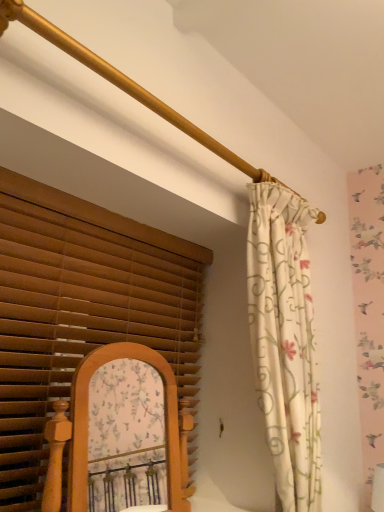
Measure the distance between floral fabric curtain at right and camera.

The depth of floral fabric curtain at right is 4.42 feet.

This screenshot has height=512, width=384. Identify the location of floral fabric curtain at right. (284, 340).

Image resolution: width=384 pixels, height=512 pixels. What do you see at coordinates (284, 340) in the screenshot? I see `floral fabric curtain at right` at bounding box center [284, 340].

Where is `brown wood blinds at left`? This screenshot has width=384, height=512. brown wood blinds at left is located at coordinates (81, 311).

The height and width of the screenshot is (512, 384). Describe the element at coordinates (81, 311) in the screenshot. I see `brown wood blinds at left` at that location.

The height and width of the screenshot is (512, 384). In order to click on floral fabric curtain at right in this screenshot , I will do `click(284, 340)`.

Does floral fabric curtain at right appear on the right side of brown wood blinds at left?

Yes, floral fabric curtain at right is to the right of brown wood blinds at left.

In the image, is floral fabric curtain at right positioned in front of or behind brown wood blinds at left?

In the image, floral fabric curtain at right appears behind brown wood blinds at left.

Considering the positions of point (309, 403) and point (43, 397), is point (309, 403) closer or farther from the camera than point (43, 397)?

Point (309, 403) is positioned farther from the camera compared to point (43, 397).

From the image's perspective, which one is positioned lower, floral fabric curtain at right or brown wood blinds at left?

brown wood blinds at left appears lower in the image.

From a real-world perspective, relative to brown wood blinds at left, is floral fabric curtain at right vertically above or below?

From a real-world perspective, floral fabric curtain at right is physically above brown wood blinds at left.

Considering the sizes of floral fabric curtain at right and brown wood blinds at left in the image, is floral fabric curtain at right wider or thinner than brown wood blinds at left?

floral fabric curtain at right is wider than brown wood blinds at left.

Consider the image. Which of these two, floral fabric curtain at right or brown wood blinds at left, stands taller?

With more height is floral fabric curtain at right.

Is floral fabric curtain at right smaller than brown wood blinds at left?

No, floral fabric curtain at right is not smaller than brown wood blinds at left.

Do you think floral fabric curtain at right is within brown wood blinds at left, or outside of it?

floral fabric curtain at right is outside brown wood blinds at left.

Is floral fabric curtain at right touching brown wood blinds at left?

No, floral fabric curtain at right is not making contact with brown wood blinds at left.

Could you tell me if floral fabric curtain at right is turned towards brown wood blinds at left?

No, floral fabric curtain at right is not turned towards brown wood blinds at left.

Consider the image. Measure the distance from floral fabric curtain at right to brown wood blinds at left.

They are 20.38 inches apart.

Identify the location of curtain that is behind the brown wood blinds at left. The image size is (384, 512). (284, 340).

Does brown wood blinds at left appear on the right side of floral fabric curtain at right?

No.

Which object is further away from the camera taking this photo, brown wood blinds at left or floral fabric curtain at right?

floral fabric curtain at right.

Does point (80, 322) lie behind point (272, 281)?

No, (80, 322) is in front of (272, 281).

From the image's perspective, relative to floral fabric curtain at right, is brown wood blinds at left above or below?

From the image's perspective, brown wood blinds at left appears below floral fabric curtain at right.

From a real-world perspective, which object stands above the other?

In real-world perspective, floral fabric curtain at right is above.

In the scene shown: Considering the sizes of objects brown wood blinds at left and floral fabric curtain at right in the image provided, who is wider, brown wood blinds at left or floral fabric curtain at right?

Wider between the two is floral fabric curtain at right.

Considering the sizes of objects brown wood blinds at left and floral fabric curtain at right in the image provided, who is shorter, brown wood blinds at left or floral fabric curtain at right?

With less height is brown wood blinds at left.

Considering the relative sizes of brown wood blinds at left and floral fabric curtain at right in the image provided, is brown wood blinds at left smaller than floral fabric curtain at right?

Yes, brown wood blinds at left is smaller than floral fabric curtain at right.

Is brown wood blinds at left outside of floral fabric curtain at right?

Absolutely, brown wood blinds at left is external to floral fabric curtain at right.

Is brown wood blinds at left not close to floral fabric curtain at right?

That's not correct — brown wood blinds at left is a little close to floral fabric curtain at right.

Is brown wood blinds at left oriented towards floral fabric curtain at right?

Yes, brown wood blinds at left is aimed at floral fabric curtain at right.

You are a GUI agent. You are given a task and a screenshot of the screen. Output one action in this format:
    pyautogui.click(x=<x>, y=<y>)
    Task: Click on the window blind located in front of the floral fabric curtain at right
    
    Given the screenshot: What is the action you would take?
    pyautogui.click(x=81, y=311)

In order to click on curtain to the right of brown wood blinds at left in this screenshot , I will do `click(284, 340)`.

You are a GUI agent. You are given a task and a screenshot of the screen. Output one action in this format:
    pyautogui.click(x=<x>, y=<y>)
    Task: Click on the window blind below the floral fabric curtain at right (from a real-world perspective)
    The image size is (384, 512).
    Given the screenshot: What is the action you would take?
    pyautogui.click(x=81, y=311)